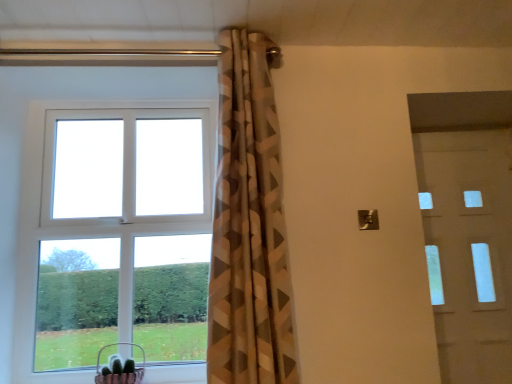
Question: Is white glossy door at right taller or shorter than geometric-patterned curtain at center?

Choices:
 (A) short
 (B) tall

Answer: (A)

Question: Which is correct: white glossy door at right is inside geometric-patterned curtain at center, or outside of it?

Choices:
 (A) inside
 (B) outside

Answer: (B)

Question: Based on their relative distances, which object is nearer to the metallic pink basket at lower left?

Choices:
 (A) geometric-patterned curtain at center
 (B) white plastic window at upper left
 (C) white glossy door at right

Answer: (B)

Question: Based on their relative distances, which object is nearer to the geometric-patterned curtain at center?

Choices:
 (A) white glossy door at right
 (B) metallic pink basket at lower left
 (C) white plastic window at upper left

Answer: (C)